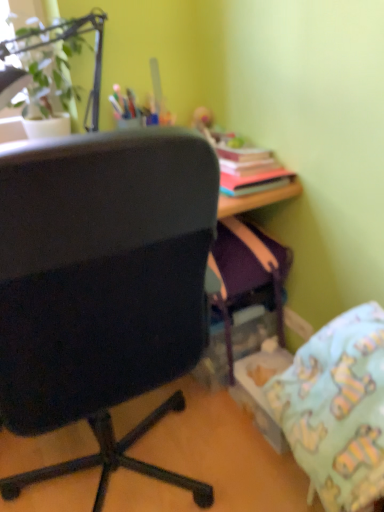
Question: Is point (291, 411) positioned closer to the camera than point (94, 99)?

Choices:
 (A) closer
 (B) farther

Answer: (A)

Question: Relative to green leafy plant at upper left, is light blue fabric pillow at lower right in front or behind?

Choices:
 (A) front
 (B) behind

Answer: (A)

Question: Estimate the real-world distances between objects in this image. Which object is farther from the green leafy plant at upper left?

Choices:
 (A) black fabric chair at left
 (B) light blue fabric pillow at lower right

Answer: (B)

Question: Which is farther from the black fabric chair at left?

Choices:
 (A) green leafy plant at upper left
 (B) light blue fabric pillow at lower right

Answer: (A)